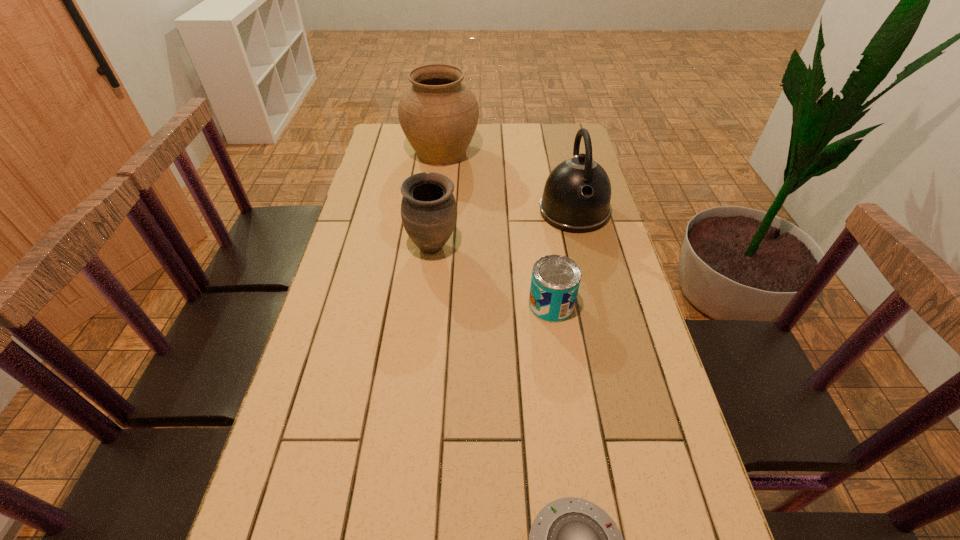
Locate an element on the screen. free point located on the front of the fourth farthest object is located at coordinates pyautogui.click(x=574, y=462).

Where is `object located in the far edge section of the desktop`? object located in the far edge section of the desktop is located at coordinates (438, 114).

At what (x,y) coordinates should I click in order to perform the action: click on object located in the left edge section of the desktop. Please return your answer as a coordinate pair (x, y). Looking at the image, I should click on (438, 114).

At what (x,y) coordinates should I click in order to perform the action: click on object that is at the right edge. Please return your answer as a coordinate pair (x, y). The height and width of the screenshot is (540, 960). Looking at the image, I should click on (576, 199).

Locate an element on the screen. object that is positioned at the far left corner is located at coordinates (438, 114).

What are the coordinates of `blank space at the left edge` in the screenshot? It's located at (301, 487).

This screenshot has height=540, width=960. I want to click on free space at the right edge, so click(x=652, y=424).

This screenshot has height=540, width=960. What are the coordinates of `unoccupied position between the nearer urn and the fourth farthest object` in the screenshot? It's located at (492, 276).

You are a GUI agent. You are given a task and a screenshot of the screen. Output one action in this format:
    pyautogui.click(x=<x>, y=<y>)
    Task: Click on the free point between the kettle and the taller urn
    This screenshot has width=960, height=540.
    Given the screenshot: What is the action you would take?
    pyautogui.click(x=508, y=182)

You are a GUI agent. You are given a task and a screenshot of the screen. Output one action in this format:
    pyautogui.click(x=<x>, y=<y>)
    Task: Click on the vacant region between the kettle and the nearer urn
    Image resolution: width=960 pixels, height=540 pixels.
    Given the screenshot: What is the action you would take?
    pyautogui.click(x=503, y=229)